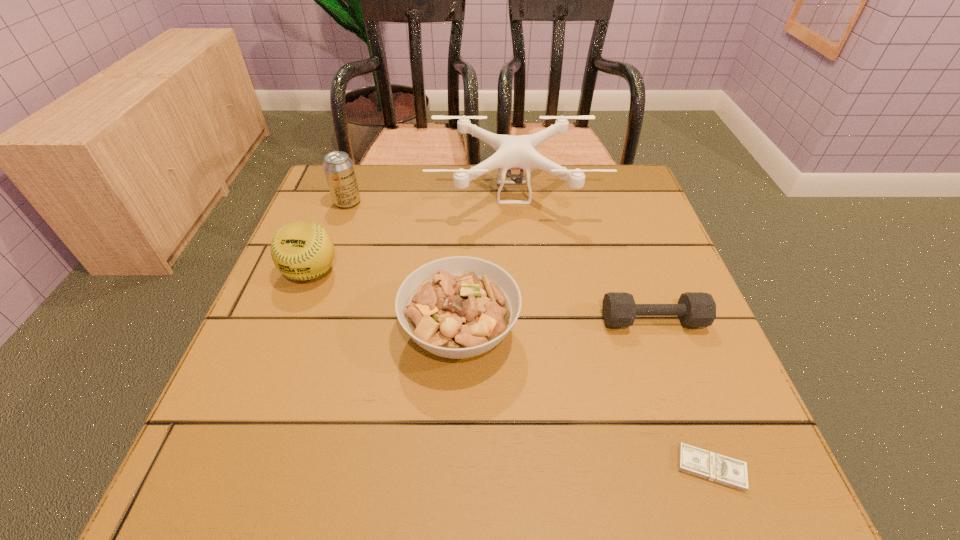
Locate an element on the screen. This screenshot has height=540, width=960. vacant space that satisfies the following two spatial constraints: 1. on the logo side of the softball; 2. on the left side of the dumbbell is located at coordinates (292, 320).

Locate an element on the screen. The width and height of the screenshot is (960, 540). vacant space that satisfies the following two spatial constraints: 1. on the front side of the nearest object; 2. on the right side of the beer can is located at coordinates (252, 468).

Find the location of a particular element. The width and height of the screenshot is (960, 540). free space that satisfies the following two spatial constraints: 1. on the front side of the beer can; 2. on the right side of the second shortest object is located at coordinates (304, 320).